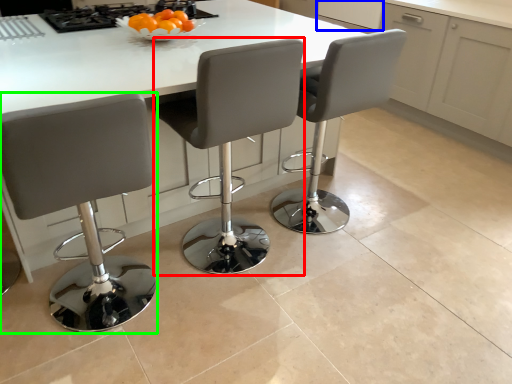
Question: Which object is positioned farthest from chair (highlighted by a red box)? Select from cabinetry (highlighted by a blue box) and chair (highlighted by a green box).

Choices:
 (A) cabinetry
 (B) chair

Answer: (A)